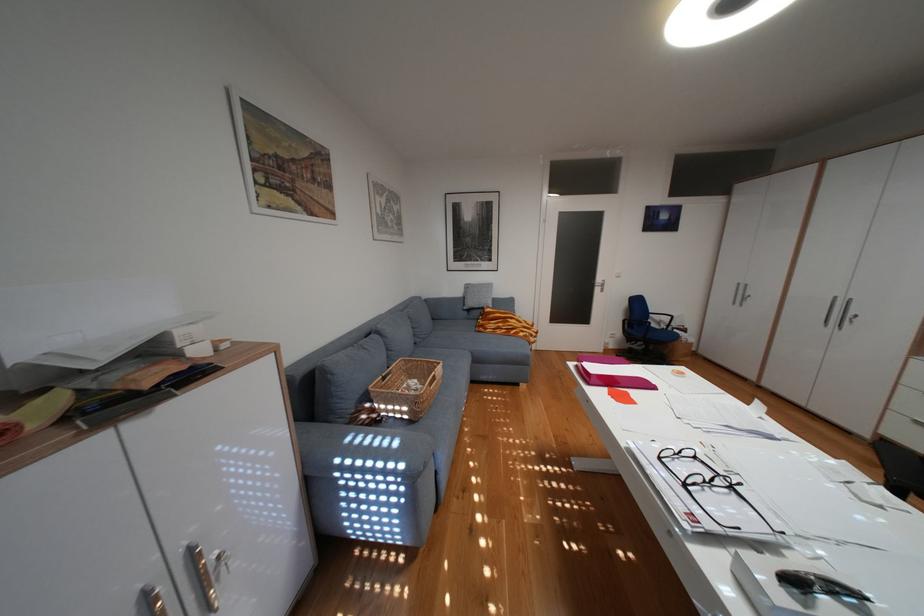
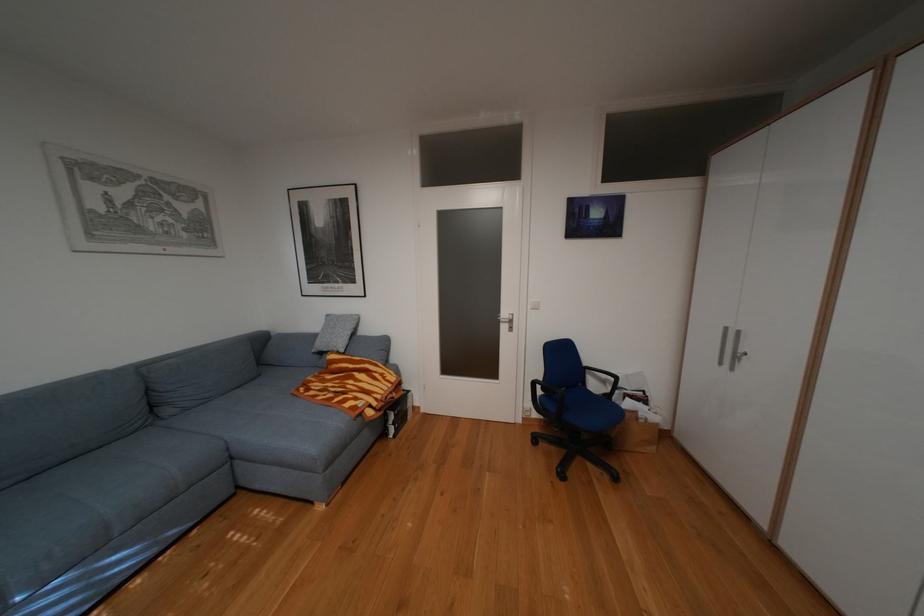
The images are taken continuously from a first-person perspective. In which direction are you moving?

The cameraman moved toward right, forward.